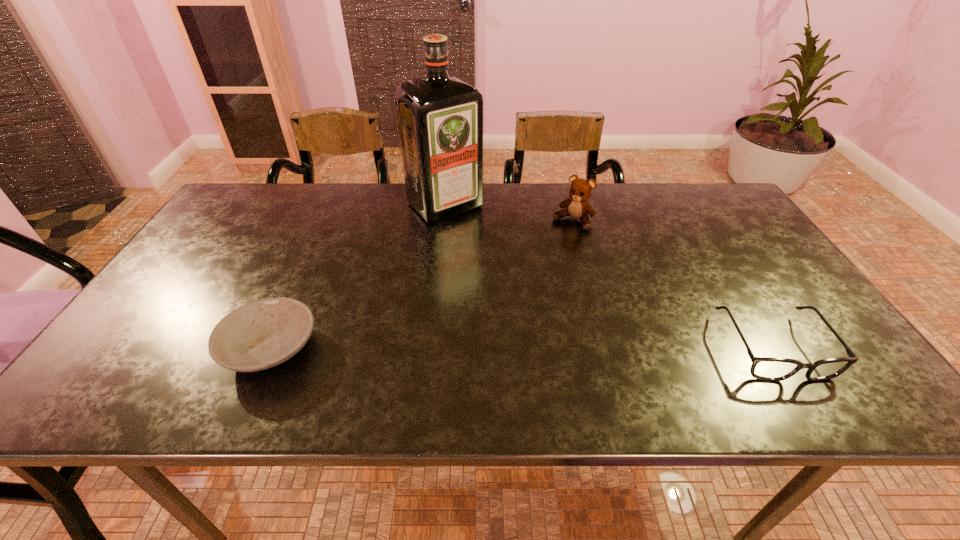
Where is `vacant space on the desktop that is between the bowl and the spectacles and is positioned on the front label of the tallest object`? This screenshot has height=540, width=960. vacant space on the desktop that is between the bowl and the spectacles and is positioned on the front label of the tallest object is located at coordinates (595, 347).

What are the coordinates of `free spot on the desktop that is between the bowl and the rightmost object and is positioned on the front-facing side of the teddy bear` in the screenshot? It's located at click(x=475, y=348).